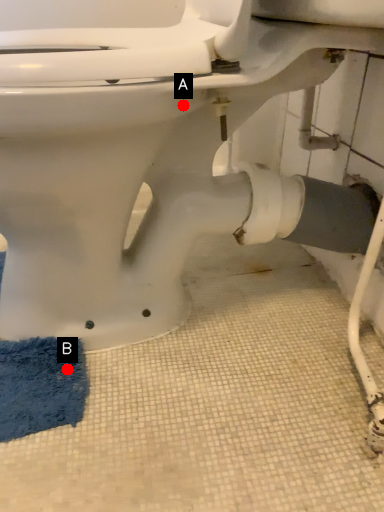
Question: Two points are circled on the image, labeled by A and B beside each circle. Which of the following is the closest to the observer?

Choices:
 (A) A is closer
 (B) B is closer

Answer: (A)